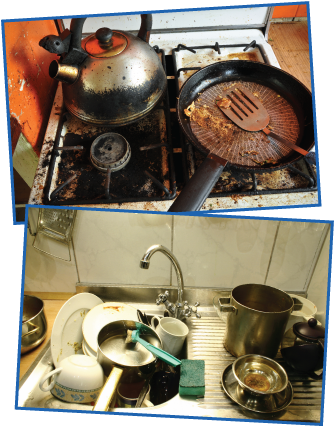
You are a GUI agent. You are given a task and a screenshot of the screen. Output one action in this format:
    pyautogui.click(x=<x>, y=<y>)
    Task: Click on the dirty stainless steel teapot
    
    Given the screenshot: What is the action you would take?
    pyautogui.click(x=119, y=79)